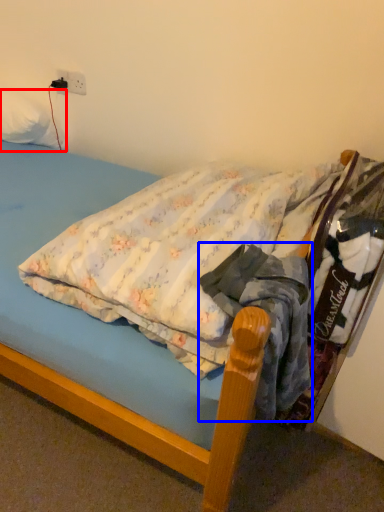
Question: Which point is further to the camera, pillow (highlighted by a red box) or clothing (highlighted by a blue box)?

Choices:
 (A) pillow
 (B) clothing

Answer: (A)